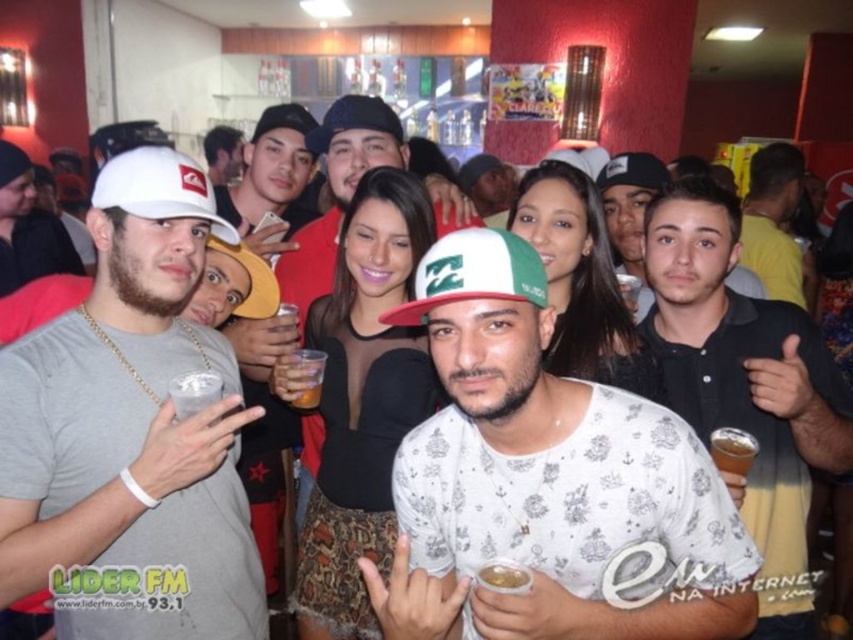
Who is taller, white cotton shirt at center or white matte cap at left?

Standing taller between the two is white matte cap at left.

Between white cotton shirt at center and white matte cap at left, which one appears on the left side from the viewer's perspective?

white matte cap at left is more to the left.

Identify the location of white cotton shirt at center. click(x=543, y=476).

At what (x,y) coordinates should I click in order to perform the action: click on white cotton shirt at center. Please return your answer as a coordinate pair (x, y). Looking at the image, I should click on (543, 476).

Measure the distance between point (769,458) and camera.

Point (769,458) and camera are 5.44 feet apart.

Does black matte shirt at center appear under matte black cap at center?

Indeed, black matte shirt at center is positioned under matte black cap at center.

Where is `black matte shirt at center`? black matte shirt at center is located at coordinates (746, 384).

Is point (614, 218) behind point (222, 252)?

Yes, it is.

Looking at this image, is matte black shirt at center bigger than yellow fabric baseball cap at center?

Correct, matte black shirt at center is larger in size than yellow fabric baseball cap at center.

Is point (641, 170) positioned before point (273, 310)?

That is False.

I want to click on matte black shirt at center, so click(x=634, y=209).